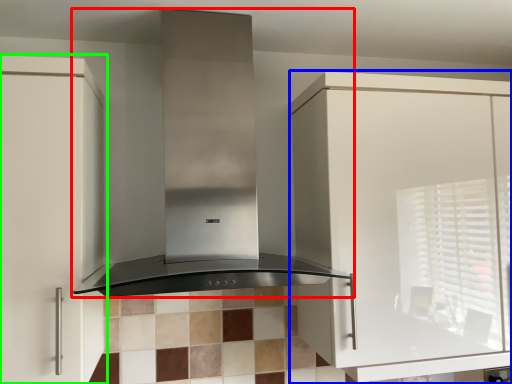
Question: Considering the real-world distances, which object is closest to home appliance (highlighted by a red box)? cabinetry (highlighted by a blue box) or cabinetry (highlighted by a green box).

Choices:
 (A) cabinetry
 (B) cabinetry

Answer: (B)